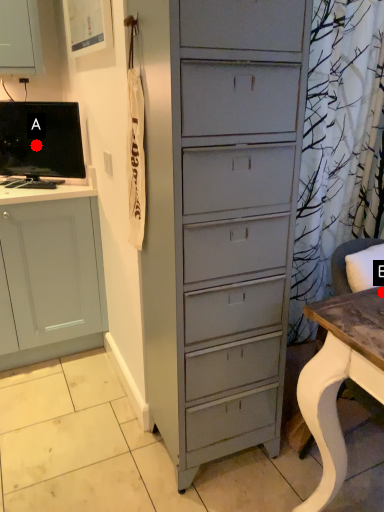
Question: Two points are circled on the image, labeled by A and B beside each circle. Which of the following is the closest to the observer?

Choices:
 (A) A is closer
 (B) B is closer

Answer: (B)